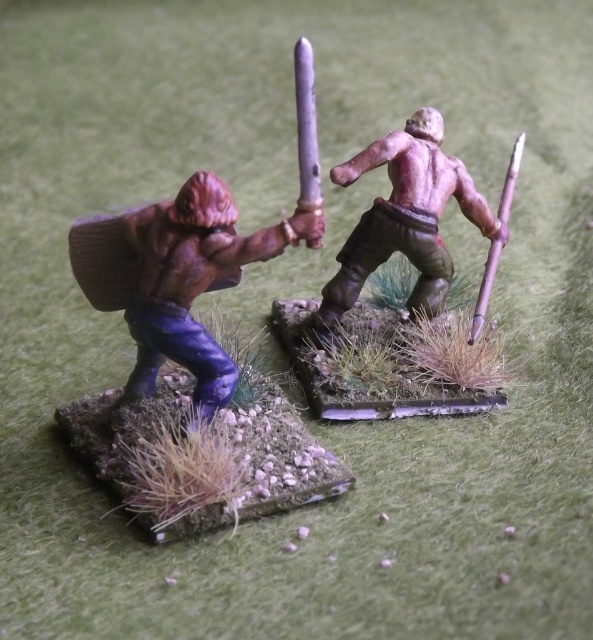
Question: Does matte brown shield at left have a larger size compared to smooth brown spear at center?

Choices:
 (A) no
 (B) yes

Answer: (A)

Question: Which point is closer to the camera?

Choices:
 (A) (301, 141)
 (B) (416, 164)
 (C) (495, 268)
 (D) (199, 365)

Answer: (A)

Question: Which of the following is the farthest from the observer?

Choices:
 (A) shiny silver sword at center
 (B) shiny bronze spear at upper right
 (C) smooth brown spear at center

Answer: (B)

Question: Which point is closer to the camera taking this photo?

Choices:
 (A) (483, 308)
 (B) (305, 218)
 (C) (243, 243)
 (D) (422, 195)

Answer: (B)

Question: Can you confirm if matte brown shield at left is wider than smooth brown spear at center?

Choices:
 (A) yes
 (B) no

Answer: (A)

Question: Is matte brown shield at left below shiny bronze spear at upper right?

Choices:
 (A) no
 (B) yes

Answer: (B)